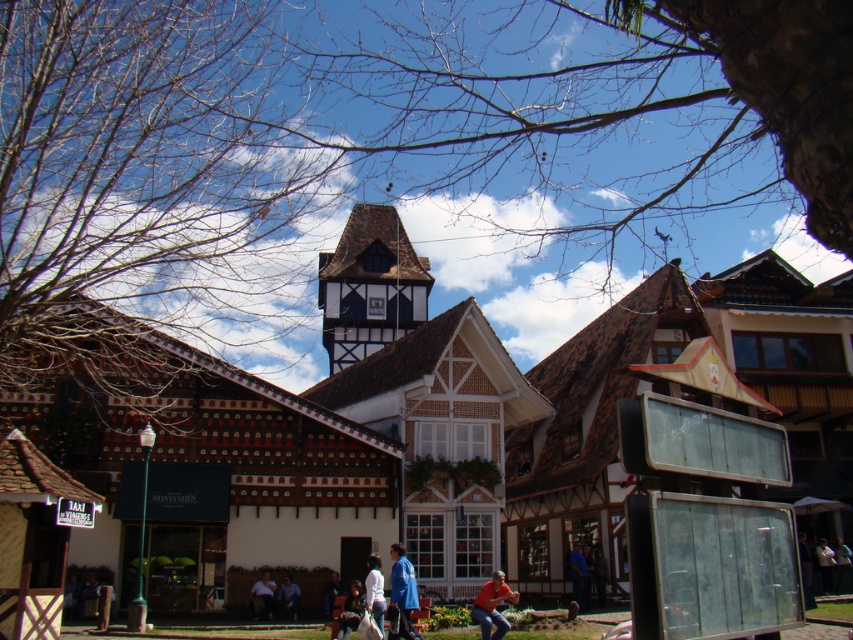
You are a traveler standing in the village square and see a person wearing both the white matte jacket at lower center and the blue denim jeans at lower center. Which piece of clothing is more noticeable to you?

The white matte jacket at lower center is larger in size than the blue denim jeans at lower center, so the white matte jacket at lower center is more noticeable.